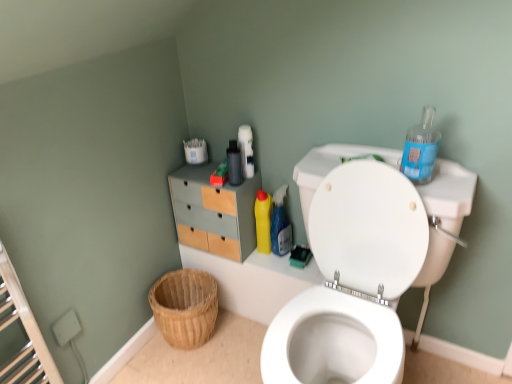
Question: From a real-world perspective, is blue plastic bottle at upper right, arranged as the first cleaning product when viewed from the right, located beneath matte black bottle at upper center?

Choices:
 (A) yes
 (B) no

Answer: (B)

Question: Can you confirm if blue plastic bottle at upper right, placed as the 3th cleaning product when sorted from left to right, is bigger than matte black bottle at upper center?

Choices:
 (A) no
 (B) yes

Answer: (B)

Question: Is the depth of blue plastic bottle at upper right, arranged as the first cleaning product when viewed from the right, greater than that of matte black bottle at upper center?

Choices:
 (A) yes
 (B) no

Answer: (B)

Question: Is blue plastic bottle at upper right, which appears as the 3th cleaning product when viewed from the back, not inside matte black bottle at upper center?

Choices:
 (A) no
 (B) yes

Answer: (B)

Question: Is blue plastic bottle at upper right, arranged as the first cleaning product when viewed from the right, taller than matte black bottle at upper center?

Choices:
 (A) no
 (B) yes

Answer: (A)

Question: Considering the positions of yellow plastic bottle at center, which is the first cleaning product in back-to-front order, and yellow plastic bottle at upper right, arranged as the second cleaning product when viewed from the left, in the image, is yellow plastic bottle at center, which is the first cleaning product in back-to-front order, wider or thinner than yellow plastic bottle at upper right, arranged as the second cleaning product when viewed from the left,?

Choices:
 (A) wide
 (B) thin

Answer: (B)

Question: Do you think yellow plastic bottle at center, which is counted as the first cleaning product, starting from the left, is within yellow plastic bottle at upper right, the second cleaning product viewed from the right, or outside of it?

Choices:
 (A) outside
 (B) inside

Answer: (A)

Question: From the image's perspective, is yellow plastic bottle at center, which is the first cleaning product in back-to-front order, positioned above or below yellow plastic bottle at upper right, which is counted as the 2th cleaning product, starting from the back?

Choices:
 (A) below
 (B) above

Answer: (B)

Question: In terms of size, does yellow plastic bottle at center, which is the 3th cleaning product from front to back, appear bigger or smaller than yellow plastic bottle at upper right, the second cleaning product viewed from the right?

Choices:
 (A) small
 (B) big

Answer: (A)

Question: Relative to matte wood/file cabinet at upper left, is yellow plastic bottle at center, which is counted as the 3th cleaning product, starting from the right, in front or behind?

Choices:
 (A) behind
 (B) front

Answer: (A)

Question: From the image's perspective, is yellow plastic bottle at center, which is counted as the 3th cleaning product, starting from the right, above or below matte wood/file cabinet at upper left?

Choices:
 (A) below
 (B) above

Answer: (A)

Question: Based on their positions, is yellow plastic bottle at center, which is the 3th cleaning product from front to back, located to the left or right of matte wood/file cabinet at upper left?

Choices:
 (A) left
 (B) right

Answer: (B)

Question: From a real-world perspective, relative to matte wood/file cabinet at upper left, is yellow plastic bottle at center, which is counted as the 3th cleaning product, starting from the right, vertically above or below?

Choices:
 (A) below
 (B) above

Answer: (A)

Question: Looking at the image, does matte wood/file cabinet at upper left seem bigger or smaller compared to yellow plastic bottle at upper right, the second cleaning product viewed from the right?

Choices:
 (A) small
 (B) big

Answer: (B)

Question: From a real-world perspective, is matte wood/file cabinet at upper left positioned above or below yellow plastic bottle at upper right, the second cleaning product viewed from the right?

Choices:
 (A) below
 (B) above

Answer: (B)